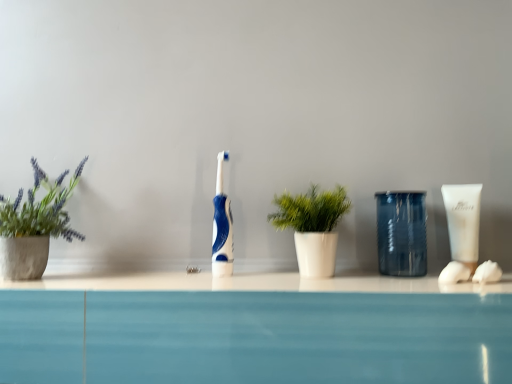
Question: Is green matte plant at left, which is the 1th houseplant from left to right, behind white cotton ball at right?

Choices:
 (A) no
 (B) yes

Answer: (B)

Question: Is green matte plant at left, the 2th houseplant viewed from the right, oriented away from white cotton ball at right?

Choices:
 (A) yes
 (B) no

Answer: (B)

Question: Considering the relative positions of green matte plant at left, which is the 1th houseplant from left to right, and white cotton ball at right in the image provided, is green matte plant at left, which is the 1th houseplant from left to right, in front of white cotton ball at right?

Choices:
 (A) no
 (B) yes

Answer: (A)

Question: Does green matte plant at left, the 2th houseplant viewed from the right, have a lesser height compared to white cotton ball at right?

Choices:
 (A) no
 (B) yes

Answer: (A)

Question: Would you say white cotton ball at right is part of green matte plant at left, the 2th houseplant viewed from the right,'s contents?

Choices:
 (A) yes
 (B) no

Answer: (B)

Question: Do you think blue glossy toothbrush at center is within transparent textured glass at center right, or outside of it?

Choices:
 (A) outside
 (B) inside

Answer: (A)

Question: Based on their positions, is blue glossy toothbrush at center located to the left or right of transparent textured glass at center right?

Choices:
 (A) right
 (B) left

Answer: (B)

Question: In terms of size, does blue glossy toothbrush at center appear bigger or smaller than transparent textured glass at center right?

Choices:
 (A) small
 (B) big

Answer: (A)

Question: In the image, is blue glossy toothbrush at center positioned in front of or behind transparent textured glass at center right?

Choices:
 (A) behind
 (B) front

Answer: (A)

Question: Is white cotton ball at right bigger or smaller than blue glossy toothbrush at center?

Choices:
 (A) small
 (B) big

Answer: (A)

Question: Is white cotton ball at right wider or thinner than blue glossy toothbrush at center?

Choices:
 (A) thin
 (B) wide

Answer: (B)

Question: From their relative heights in the image, would you say white cotton ball at right is taller or shorter than blue glossy toothbrush at center?

Choices:
 (A) short
 (B) tall

Answer: (A)

Question: Is white cotton ball at right in front of or behind blue glossy toothbrush at center in the image?

Choices:
 (A) behind
 (B) front

Answer: (B)

Question: In terms of width, does green matte plant at left, the 2th houseplant viewed from the right, look wider or thinner when compared to blue glossy toothbrush at center?

Choices:
 (A) wide
 (B) thin

Answer: (A)

Question: Would you say green matte plant at left, which is the 1th houseplant from left to right, is inside or outside blue glossy toothbrush at center?

Choices:
 (A) inside
 (B) outside

Answer: (B)